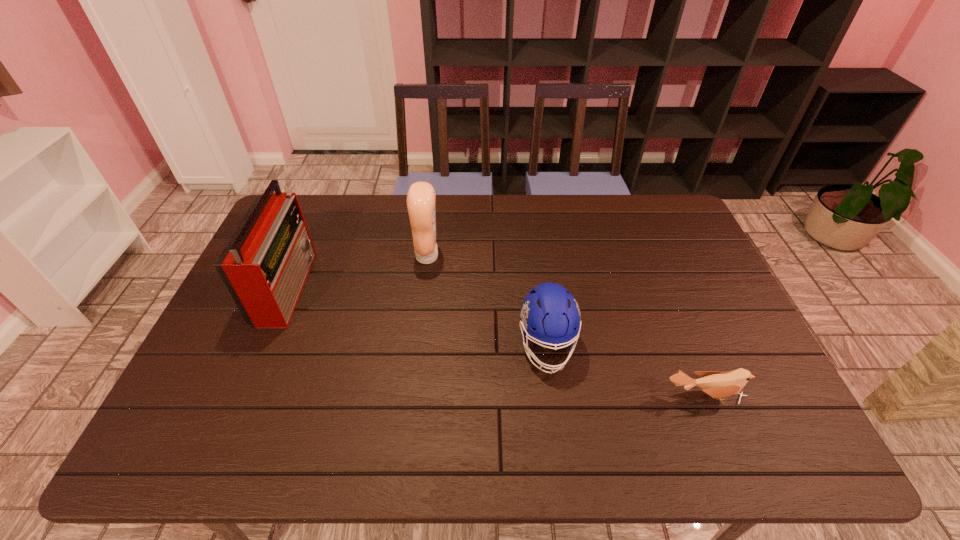
Image resolution: width=960 pixels, height=540 pixels. Find the location of `the leftmost object`. the leftmost object is located at coordinates (265, 264).

You are a GUI agent. You are given a task and a screenshot of the screen. Output one action in this format:
    pyautogui.click(x=<x>, y=<y>)
    Task: Click on the condiment
    This screenshot has width=960, height=540.
    Given the screenshot: What is the action you would take?
    pyautogui.click(x=421, y=199)

Where is `the third object from left to right`? the third object from left to right is located at coordinates (549, 314).

Where is `football helmet`? The height and width of the screenshot is (540, 960). football helmet is located at coordinates (549, 314).

Locate an element on the screen. The image size is (960, 540). the rightmost object is located at coordinates (719, 385).

Where is `bird`? bird is located at coordinates [x=719, y=385].

You are a GUI agent. You are given a task and a screenshot of the screen. Output one action in this format:
    pyautogui.click(x=<x>, y=<y>)
    Task: Click on the vacant space located on the front-facing side of the leftmost object
    The width and height of the screenshot is (960, 540).
    Given the screenshot: What is the action you would take?
    pyautogui.click(x=372, y=286)

Find the location of a particular element. vacant space located 0.090m on the label of the second object from left to right is located at coordinates (468, 256).

Where is `free point located on the face guard of the second shortest object`? The width and height of the screenshot is (960, 540). free point located on the face guard of the second shortest object is located at coordinates (560, 446).

Locate an element on the screen. Image resolution: width=960 pixels, height=540 pixels. free point located at the beak of the shortest object is located at coordinates [719, 436].